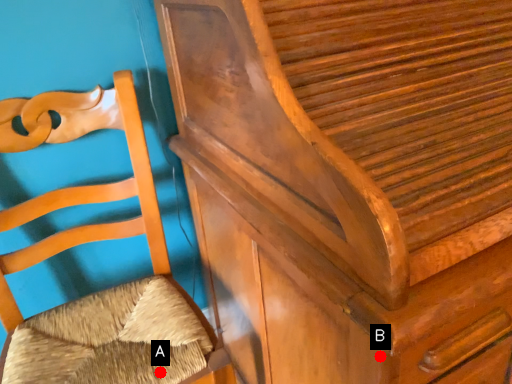
Question: Two points are circled on the image, labeled by A and B beside each circle. Which point appears closest to the camera in this image?

Choices:
 (A) A is closer
 (B) B is closer

Answer: (B)